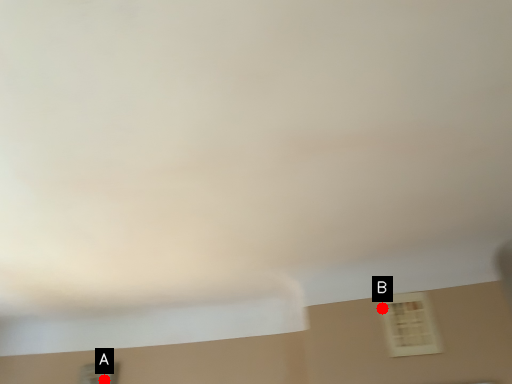
Question: Two points are circled on the image, labeled by A and B beside each circle. Which point is further to the camera?

Choices:
 (A) A is further
 (B) B is further

Answer: (A)